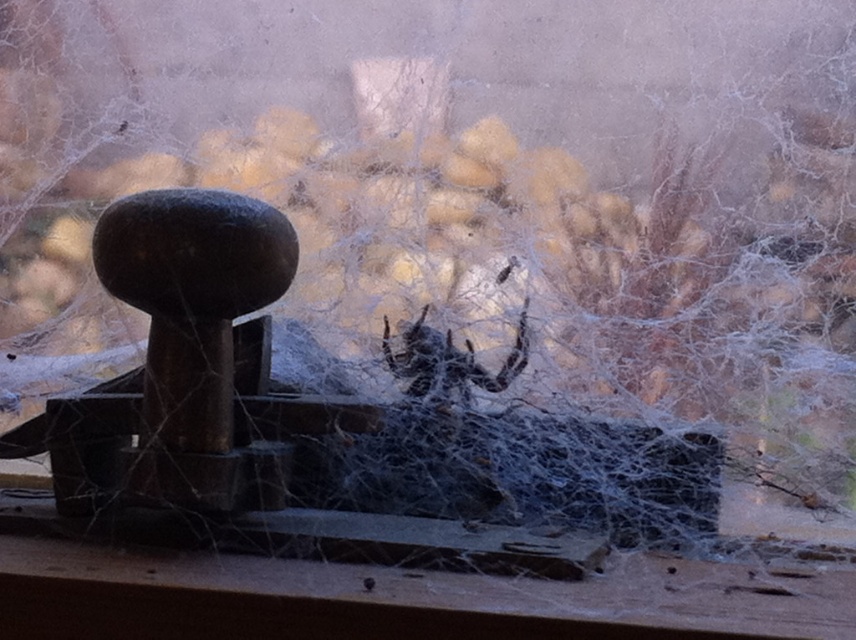
You are a curious cat sitting on the windowsill. You see the wooden at lower center and the dark brown fuzzy spider at center. Which object is nearer to your paws?

The wooden at lower center is closer to the viewer than the dark brown fuzzy spider at center, so the wooden object is nearer to your paws.